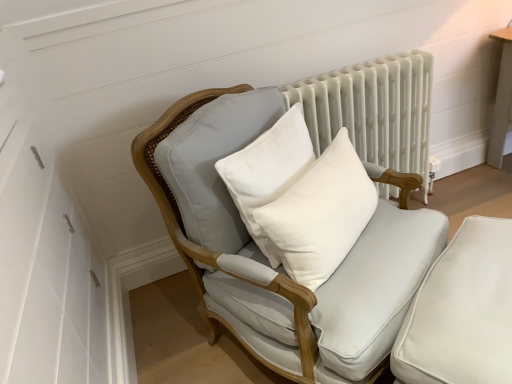
Question: Would you consider white cotton pillow at center, which is the second pillow in left-to-right order, to be distant from white cotton pillow at center, the first pillow viewed from the left?

Choices:
 (A) no
 (B) yes

Answer: (A)

Question: Is white cotton pillow at center, acting as the 2th pillow starting from the right, surrounded by white cotton pillow at center, which is the 1th pillow from right to left?

Choices:
 (A) no
 (B) yes

Answer: (A)

Question: From a real-world perspective, is white cotton pillow at center, which is the 1th pillow from right to left, over white cotton pillow at center, the first pillow viewed from the left?

Choices:
 (A) yes
 (B) no

Answer: (B)

Question: From a real-world perspective, is white cotton pillow at center, which is the 1th pillow from right to left, located beneath white cotton pillow at center, acting as the 2th pillow starting from the right?

Choices:
 (A) yes
 (B) no

Answer: (A)

Question: Is white cotton pillow at center, which is the 1th pillow from right to left, smaller than white cotton pillow at center, the first pillow viewed from the left?

Choices:
 (A) yes
 (B) no

Answer: (B)

Question: Is white cotton pillow at center, which is the second pillow in left-to-right order, positioned before white cotton pillow at center, the first pillow viewed from the left?

Choices:
 (A) no
 (B) yes

Answer: (B)

Question: Is white painted radiator at upper center smaller than white cotton pillow at center, which is the 1th pillow from right to left?

Choices:
 (A) no
 (B) yes

Answer: (A)

Question: Can white cotton pillow at center, which is the 1th pillow from right to left, be found inside white painted radiator at upper center?

Choices:
 (A) no
 (B) yes

Answer: (A)

Question: Does white painted radiator at upper center have a greater width compared to white cotton pillow at center, which is the second pillow in left-to-right order?

Choices:
 (A) no
 (B) yes

Answer: (B)

Question: Is white painted radiator at upper center not near white cotton pillow at center, which is the 1th pillow from right to left?

Choices:
 (A) yes
 (B) no

Answer: (B)

Question: From the image's perspective, is white painted radiator at upper center below white cotton pillow at center, which is the 1th pillow from right to left?

Choices:
 (A) yes
 (B) no

Answer: (B)

Question: Can you confirm if white painted radiator at upper center is positioned to the right of white cotton pillow at center, which is the 1th pillow from right to left?

Choices:
 (A) no
 (B) yes

Answer: (B)

Question: Does white cotton pillow at center, which is the second pillow in left-to-right order, have a greater height compared to white fabric chair at center?

Choices:
 (A) no
 (B) yes

Answer: (A)